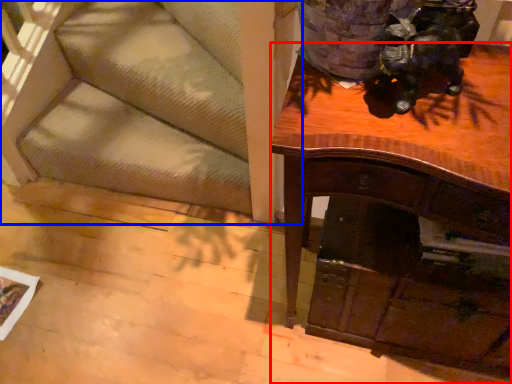
Question: Among these objects, which one is nearest to the camera, desk (highlighted by a red box) or furniture (highlighted by a blue box)?

Choices:
 (A) desk
 (B) furniture

Answer: (A)